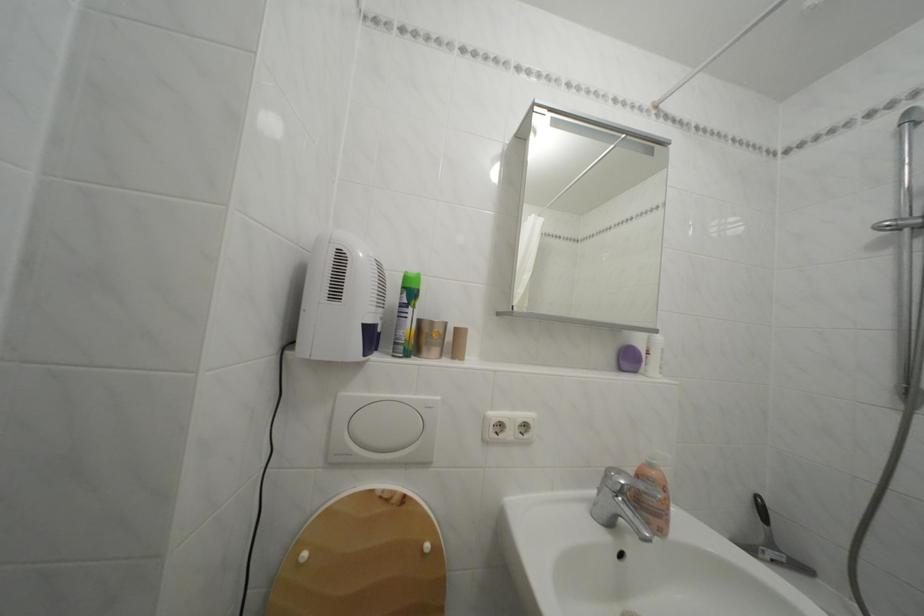
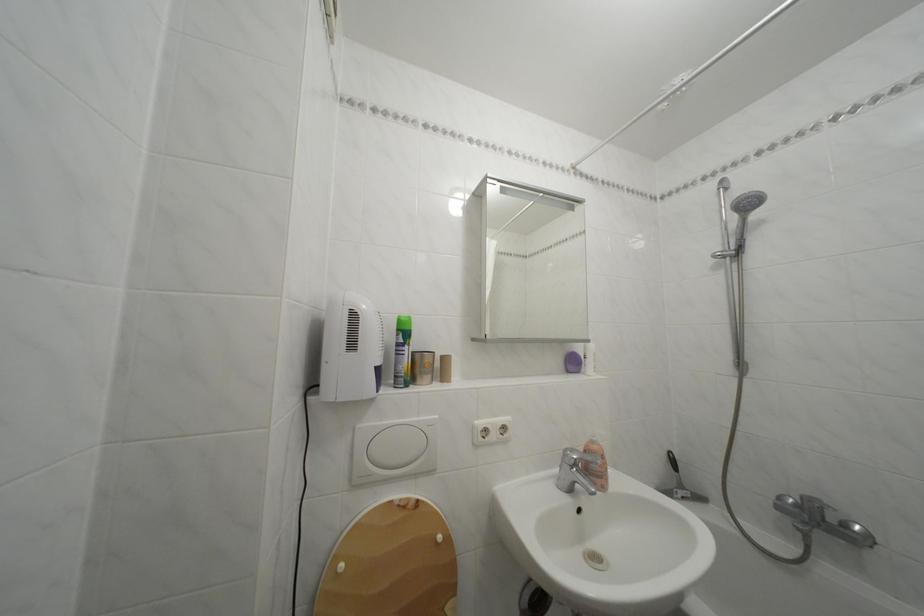
In the second image, find the point that corresponds to point (660, 472) in the first image.

(602, 448)